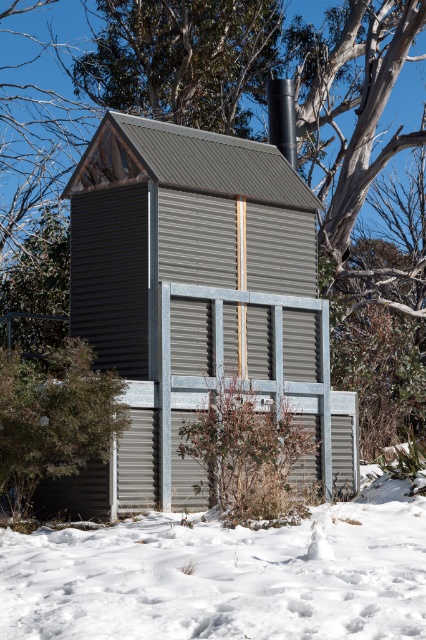
Question: Is gray corrugated metal hut at center to the right of green leafy shrub at lower left from the viewer's perspective?

Choices:
 (A) yes
 (B) no

Answer: (A)

Question: Is gray corrugated metal hut at center thinner than white powdery snow at lower center?

Choices:
 (A) yes
 (B) no

Answer: (A)

Question: Among these points, which one is farthest from the camera?

Choices:
 (A) (321, 397)
 (B) (23, 508)

Answer: (A)

Question: Estimate the real-world distances between objects in this image. Which object is closer to the green leafy shrub at lower left?

Choices:
 (A) gray corrugated metal hut at center
 (B) white powdery snow at lower center

Answer: (A)

Question: Which object is the farthest from the gray corrugated metal hut at center?

Choices:
 (A) white powdery snow at lower center
 (B) green leafy shrub at lower left

Answer: (A)

Question: Observing the image, what is the correct spatial positioning of gray corrugated metal hut at center in reference to green leafy shrub at lower left?

Choices:
 (A) below
 (B) above

Answer: (A)